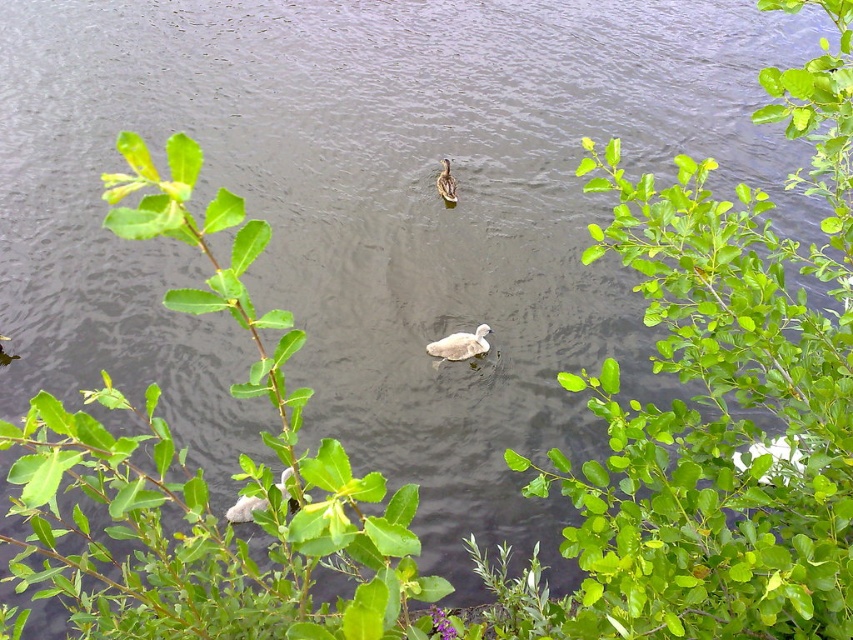
Question: Which of the following is the farthest from the observer?

Choices:
 (A) green leafy plant at center
 (B) white fluffy swan at center
 (C) brown feathered duck at center

Answer: (C)

Question: From the image, what is the correct spatial relationship of white fluffy swan at center in relation to brown feathered duck at center?

Choices:
 (A) left
 (B) right

Answer: (B)

Question: Can you confirm if green leafy plant at center is thinner than white fluffy swan at center?

Choices:
 (A) yes
 (B) no

Answer: (B)

Question: Which of the following is the closest to the observer?

Choices:
 (A) white fluffy swan at center
 (B) green leafy plant at center
 (C) brown feathered duck at center

Answer: (B)

Question: Among these objects, which one is farthest from the camera?

Choices:
 (A) white fluffy swan at center
 (B) brown feathered duck at center

Answer: (B)

Question: Is green leafy plant at center to the left of brown feathered duck at center from the viewer's perspective?

Choices:
 (A) yes
 (B) no

Answer: (A)